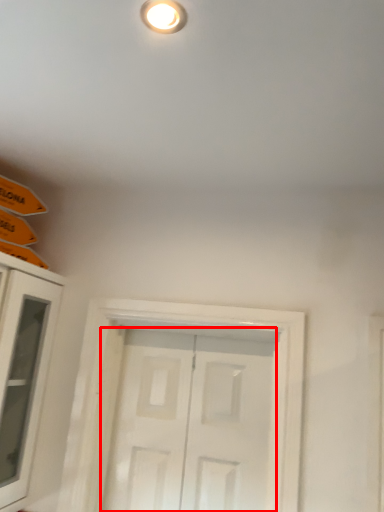
Question: From the image's perspective, what is the correct spatial relationship of door (annotated by the red box) in relation to cabinetry?

Choices:
 (A) below
 (B) above

Answer: (A)